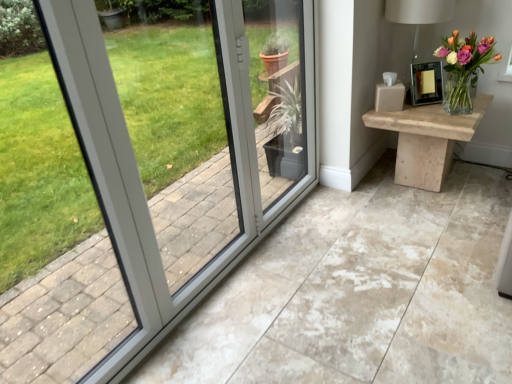
At what (x,y) coordinates should I click in order to perform the action: click on vacant space in front of natural wood table at right. Please return your answer as a coordinate pair (x, y). This screenshot has width=512, height=384. Looking at the image, I should click on (436, 226).